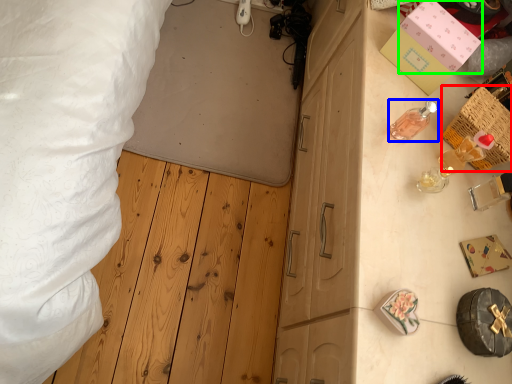
Question: Which is nearer to the crate (highlighted by a red box)? toiletry (highlighted by a blue box) or box (highlighted by a green box).

Choices:
 (A) toiletry
 (B) box

Answer: (A)